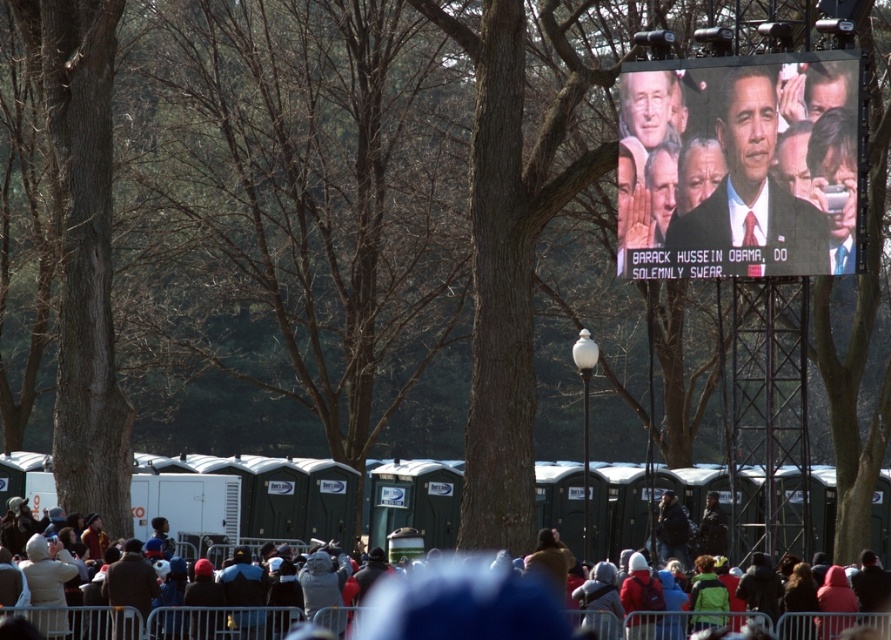
Question: Which point appears closest to the camera in this image?

Choices:
 (A) (815, 209)
 (B) (805, 618)

Answer: (B)

Question: Is matte black screen at upper center above dark gray fabric crowd at lower center?

Choices:
 (A) no
 (B) yes

Answer: (B)

Question: Which of the following is the closest to the observer?

Choices:
 (A) dark gray fabric crowd at lower center
 (B) matte black screen at upper center

Answer: (A)

Question: Does matte black screen at upper center lie in front of dark gray fabric crowd at lower center?

Choices:
 (A) yes
 (B) no

Answer: (B)

Question: Observing the image, what is the correct spatial positioning of matte black screen at upper center in reference to dark gray fabric crowd at lower center?

Choices:
 (A) below
 (B) above

Answer: (B)